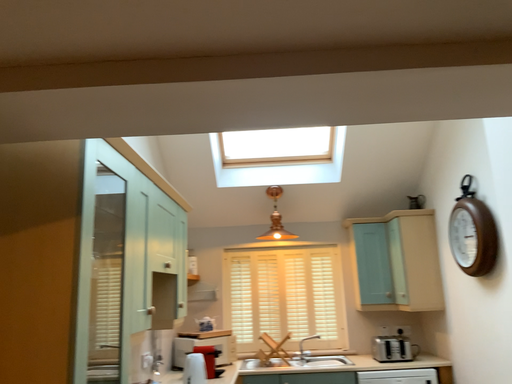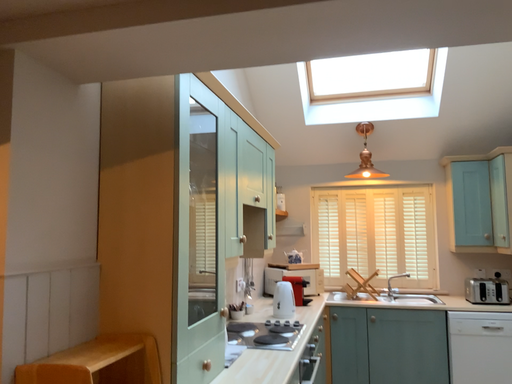
Question: How did the camera likely rotate when shooting the video?

Choices:
 (A) rotated left
 (B) rotated right

Answer: (A)